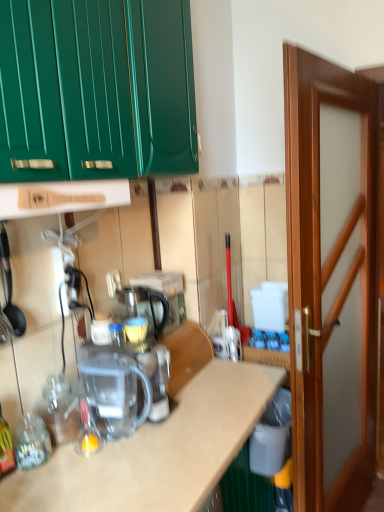
The height and width of the screenshot is (512, 384). I want to click on free point above wooden at center (from a real-world perspective), so click(x=208, y=395).